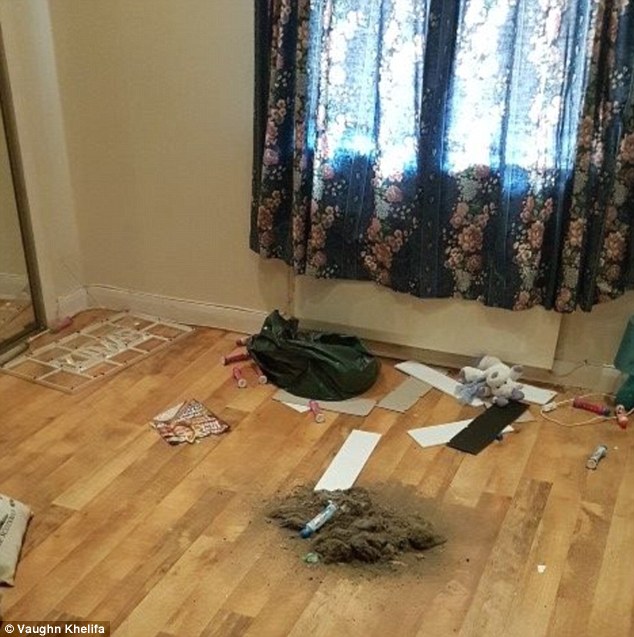
Where is `floorboard in room`? The width and height of the screenshot is (634, 637). floorboard in room is located at coordinates (573, 517).